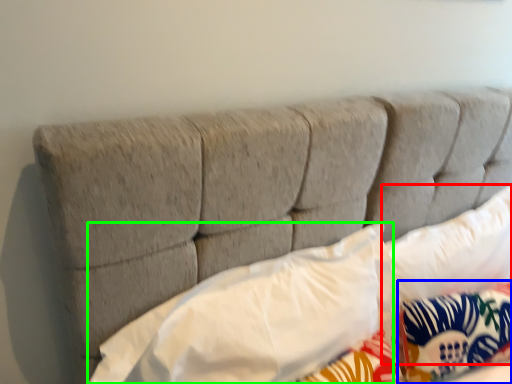
Question: Based on their relative distances, which object is nearer to pillow (highlighted by a red box)? Choose from pillow (highlighted by a blue box) and pillow (highlighted by a green box).

Choices:
 (A) pillow
 (B) pillow

Answer: (A)